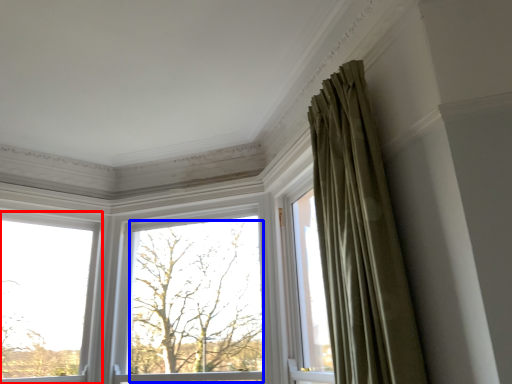
Question: Which of the following is the closest to the observer, window (highlighted by a red box) or tree (highlighted by a blue box)?

Choices:
 (A) window
 (B) tree

Answer: (A)